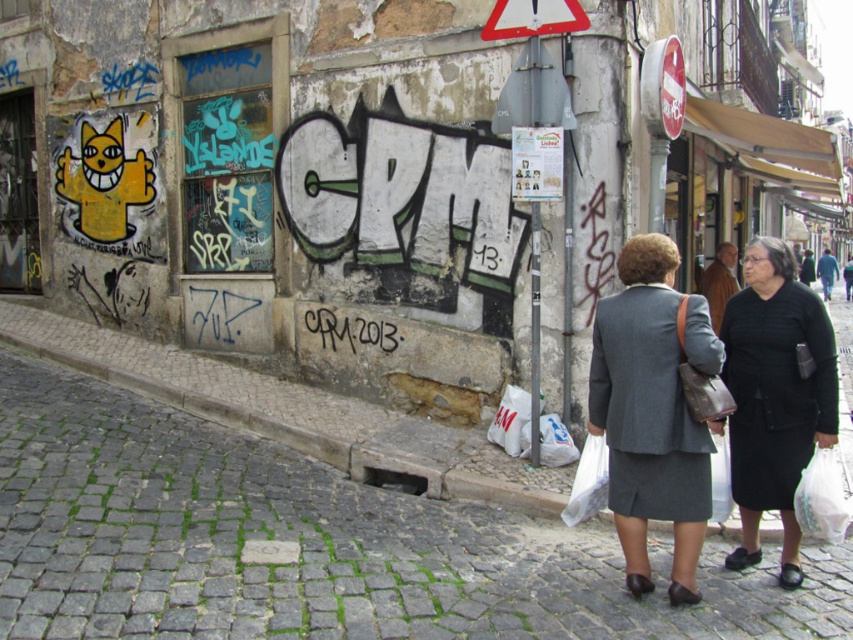
Question: Is the position of gray wool suit at center more distant than that of black matte dress at lower right?

Choices:
 (A) no
 (B) yes

Answer: (A)

Question: Can you confirm if gray wool suit at center is positioned above black graffiti at center?

Choices:
 (A) yes
 (B) no

Answer: (B)

Question: Which object is farther from the camera taking this photo?

Choices:
 (A) gray wool suit at center
 (B) black matte dress at lower right
 (C) metallic triangular sign at upper center
 (D) cobblestone pavement at lower left

Answer: (C)

Question: Does cobblestone pavement at lower left appear over black graffiti at center?

Choices:
 (A) yes
 (B) no

Answer: (B)

Question: Among these objects, which one is farthest from the camera?

Choices:
 (A) cobblestone pavement at lower left
 (B) gray wool suit at center

Answer: (A)

Question: Among these points, which one is farthest from the camera?

Choices:
 (A) (636, 435)
 (B) (735, 554)
 (C) (395, 330)

Answer: (C)